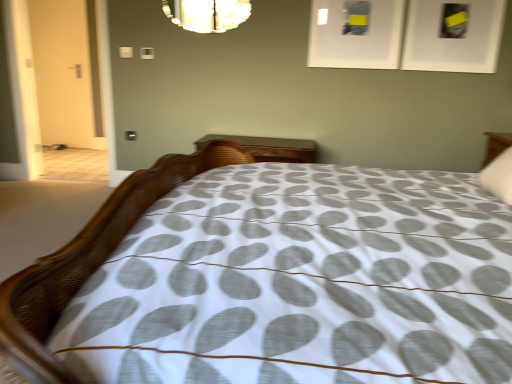
Question: From a real-world perspective, is white soft pillow at upper right under white textured bed at center?

Choices:
 (A) yes
 (B) no

Answer: (B)

Question: Is white soft pillow at upper right oriented away from white textured bed at center?

Choices:
 (A) yes
 (B) no

Answer: (A)

Question: Is white soft pillow at upper right positioned far away from white textured bed at center?

Choices:
 (A) yes
 (B) no

Answer: (B)

Question: Is white soft pillow at upper right aimed at white textured bed at center?

Choices:
 (A) no
 (B) yes

Answer: (B)

Question: Considering the relative sizes of white soft pillow at upper right and white textured bed at center in the image provided, is white soft pillow at upper right wider than white textured bed at center?

Choices:
 (A) yes
 (B) no

Answer: (B)

Question: In the image, is wooden nightstand at center positioned in front of or behind white matte picture frame at upper right, the 2th picture frame positioned from the left?

Choices:
 (A) behind
 (B) front

Answer: (A)

Question: In terms of size, does wooden nightstand at center appear bigger or smaller than white matte picture frame at upper right, positioned as the first picture frame in right-to-left order?

Choices:
 (A) big
 (B) small

Answer: (A)

Question: Looking at their shapes, would you say wooden nightstand at center is wider or thinner than white matte picture frame at upper right, the 2th picture frame positioned from the left?

Choices:
 (A) thin
 (B) wide

Answer: (B)

Question: From the image's perspective, is wooden nightstand at center located above or below white matte picture frame at upper right, positioned as the first picture frame in right-to-left order?

Choices:
 (A) below
 (B) above

Answer: (A)

Question: Considering the positions of point (168, 14) and point (88, 132), is point (168, 14) closer or farther from the camera than point (88, 132)?

Choices:
 (A) farther
 (B) closer

Answer: (B)

Question: From a real-world perspective, is shiny glass mirror at upper center above or below white matte door at left?

Choices:
 (A) below
 (B) above

Answer: (B)

Question: From their relative heights in the image, would you say shiny glass mirror at upper center is taller or shorter than white matte door at left?

Choices:
 (A) short
 (B) tall

Answer: (A)

Question: Is shiny glass mirror at upper center wider or thinner than white matte door at left?

Choices:
 (A) wide
 (B) thin

Answer: (A)

Question: From a real-world perspective, relative to white textured bed at center, is white matte picture frame at upper center, arranged as the 2th picture frame when viewed from the right, vertically above or below?

Choices:
 (A) above
 (B) below

Answer: (A)

Question: Is white matte picture frame at upper center, the 1th picture frame from the left, inside the boundaries of white textured bed at center, or outside?

Choices:
 (A) inside
 (B) outside

Answer: (B)